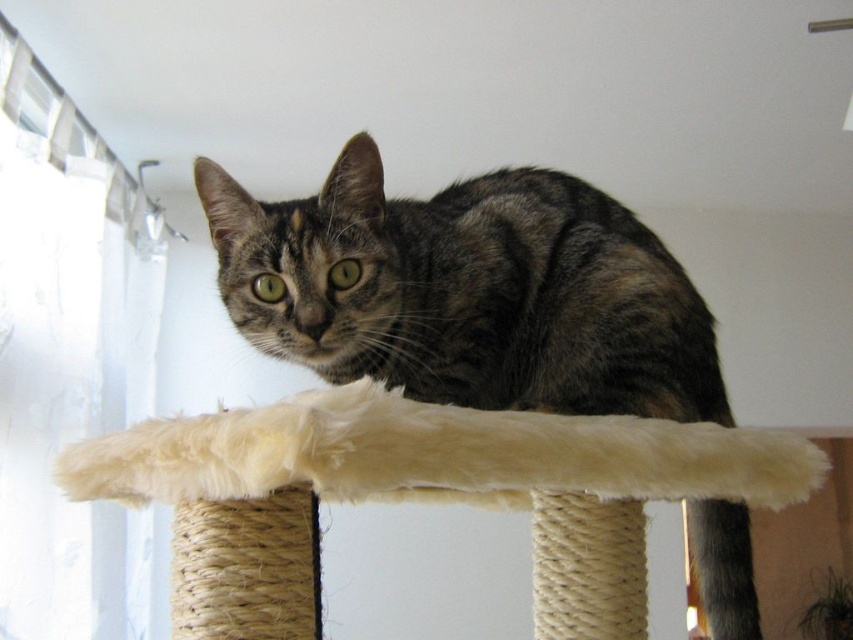
Consider the image. Who is positioned more to the right, tabby fur cat at center or white fluffy cat bed at center?

tabby fur cat at center is more to the right.

Can you confirm if tabby fur cat at center is taller than white fluffy cat bed at center?

Yes, tabby fur cat at center is taller than white fluffy cat bed at center.

Does point (321, 209) come closer to viewer compared to point (228, 637)?

No, it is behind (228, 637).

Image resolution: width=853 pixels, height=640 pixels. Identify the location of tabby fur cat at center. (467, 291).